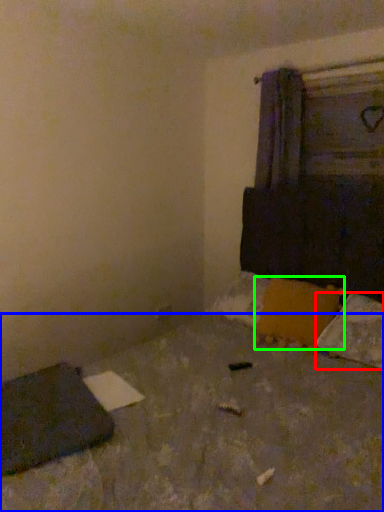
Question: Considering the real-world distances, which object is farthest from pillow (highlighted by a red box)? concrete (highlighted by a blue box) or pillow (highlighted by a green box)?

Choices:
 (A) concrete
 (B) pillow

Answer: (A)